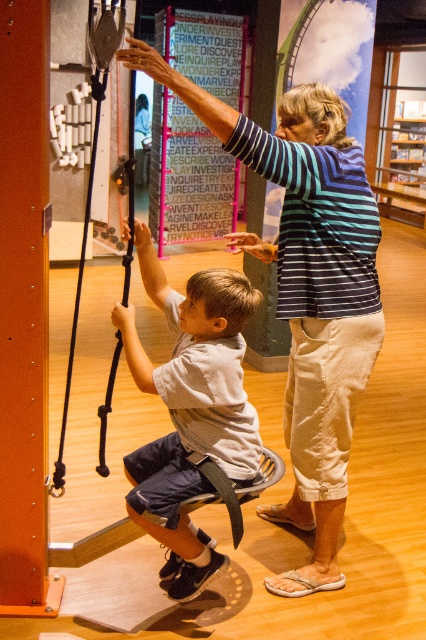
You are a museum staff member who needs to clean the area between the gray fabric shirt at center and the black rubber swing at left. The cleaning equipment you have is 16 inches wide. Can you fit the equipment between them without moving either object?

The distance between the gray fabric shirt at center and the black rubber swing at left is 15.67 inches. Since the cleaning equipment is 16 inches wide, it is slightly too wide to fit between them without moving either object.

You are a visitor in the museum and want to take a photo of the gray fabric shirt at center. Where should you position yourself to capture it in the frame?

You should position yourself facing the gray fabric shirt at center located at point (190, 410) to capture it in the frame.